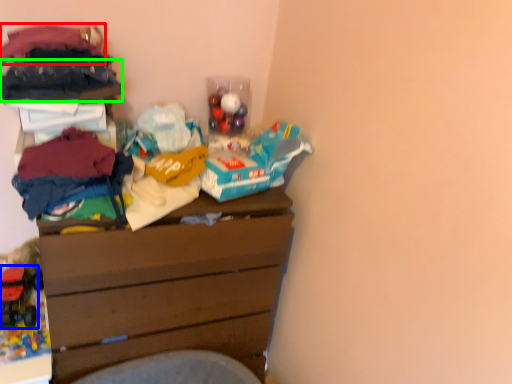
Question: Based on their relative distances, which object is nearer to clothing (highlighted by a red box)? Choose from toy (highlighted by a blue box) and clothing (highlighted by a green box).

Choices:
 (A) toy
 (B) clothing

Answer: (B)